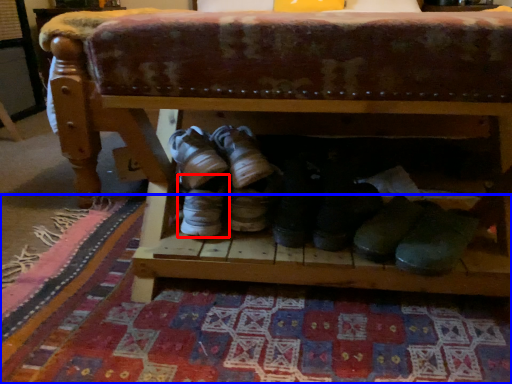
Question: Among these objects, which one is nearest to the camera, footwear (highlighted by a red box) or mat (highlighted by a blue box)?

Choices:
 (A) footwear
 (B) mat

Answer: (B)